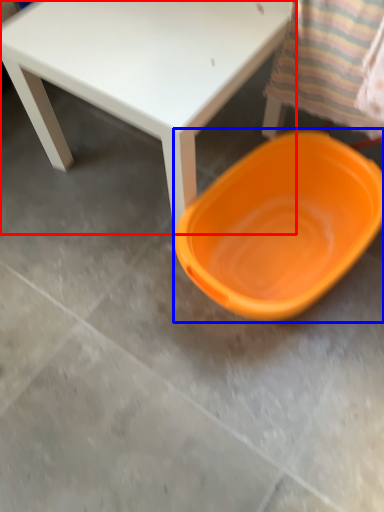
Question: Which object appears farthest to the camera in this image, table (highlighted by a red box) or plate (highlighted by a blue box)?

Choices:
 (A) table
 (B) plate

Answer: (B)